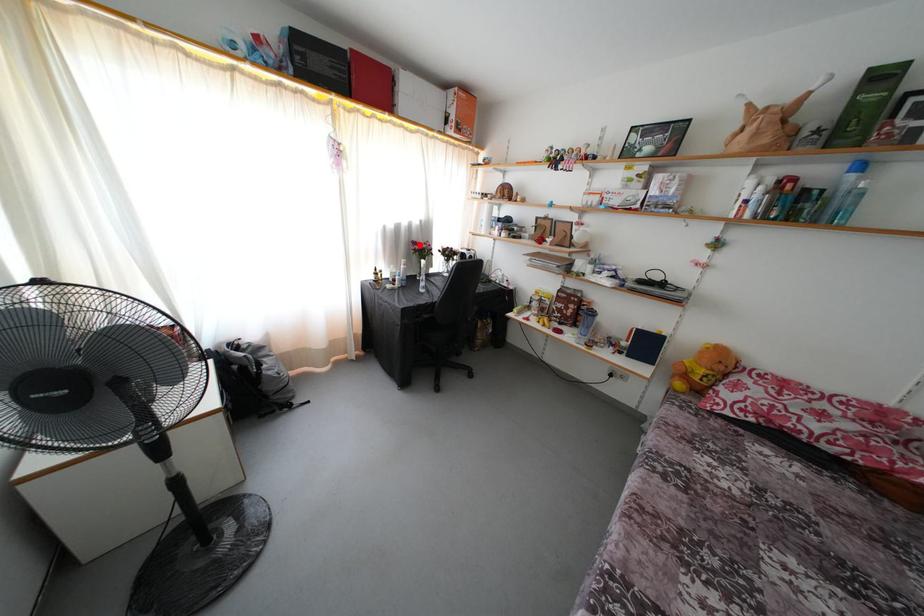
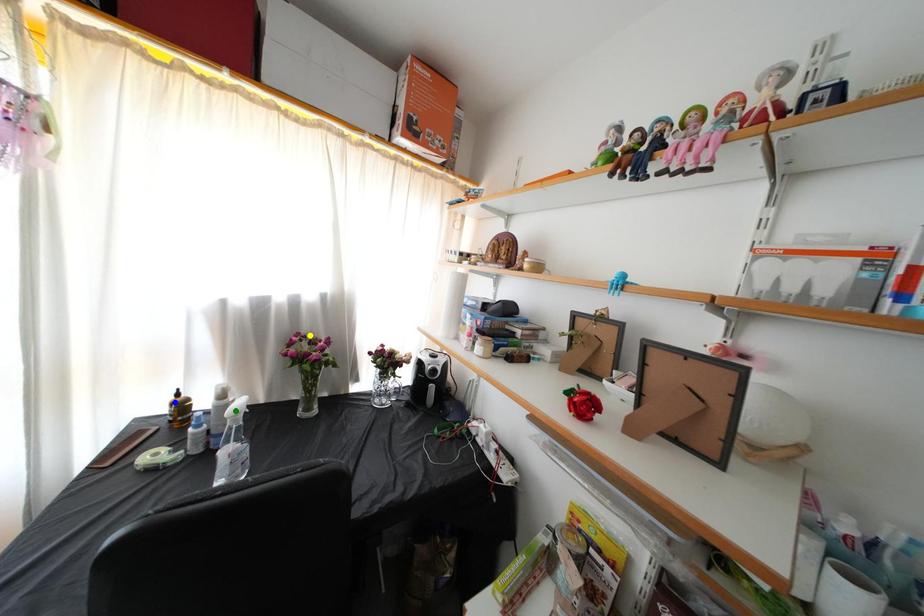
Question: I am providing you with two images of the same scene from different viewpoints. A red point is marked on the first image. You are given multiple points on the second image. Which mark in image 2 goes with the point in image 1?

Choices:
 (A) blue point
 (B) yellow point
 (C) green point

Answer: (B)